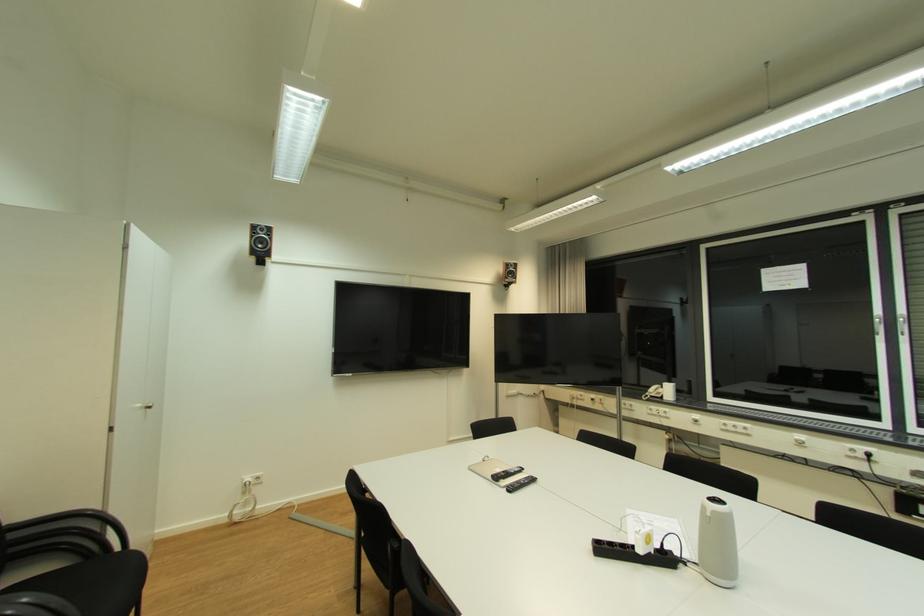
Describe the element at coordinates (96, 583) in the screenshot. I see `a black chair sitting surface` at that location.